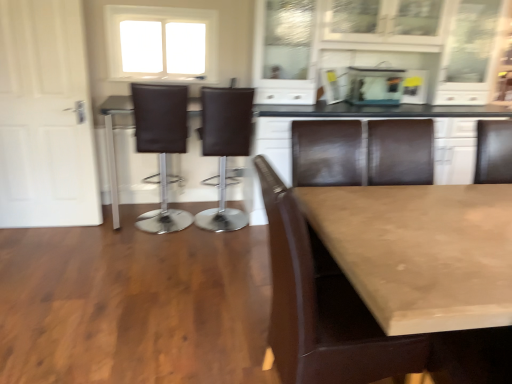
Locate an element on the screen. The image size is (512, 384). unoccupied region to the right of white matte door at left is located at coordinates (95, 238).